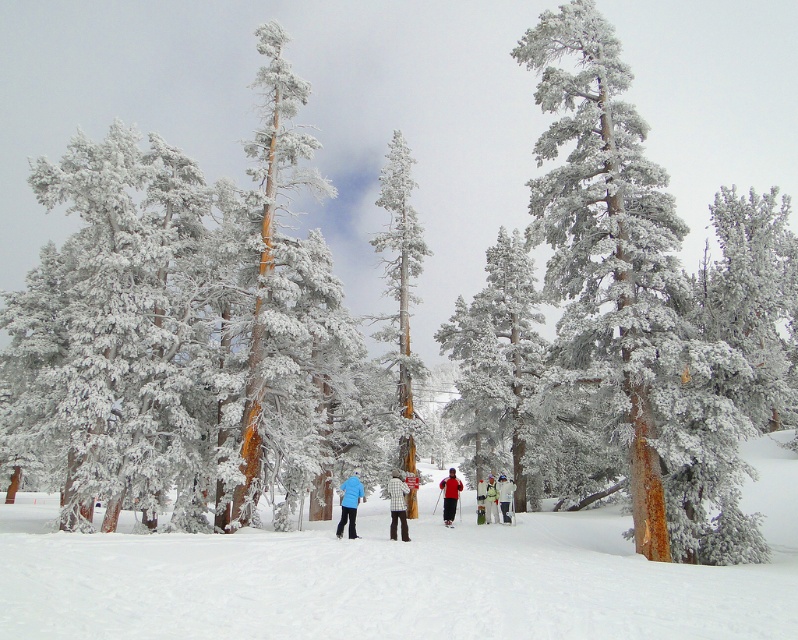
Question: Does red fabric jacket at center appear under white matte snowboarder at center?

Choices:
 (A) no
 (B) yes

Answer: (B)

Question: Among these objects, which one is nearest to the camera?

Choices:
 (A) red fabric jacket at center
 (B) white snow ski slope at center
 (C) white matte snowboarder at center
 (D) blue matte jacket at center

Answer: (B)

Question: Estimate the real-world distances between objects in this image. Which object is closer to the white snowboarder at center?

Choices:
 (A) white checkered shirt at center
 (B) white snow ski slope at center
 (C) snow-covered pine tree at center
 (D) snow-covered bark at center

Answer: (A)

Question: Which of these objects is positioned closest to the snow-covered pine tree at center?

Choices:
 (A) red fabric jacket at center
 (B) white snow ski slope at center
 (C) white checkered shirt at center

Answer: (C)

Question: Can you confirm if blue matte jacket at center is bigger than white snowboarder at center?

Choices:
 (A) no
 (B) yes

Answer: (B)

Question: In this image, where is white checkered shirt at center located relative to red fabric jacket at center?

Choices:
 (A) below
 (B) above

Answer: (B)